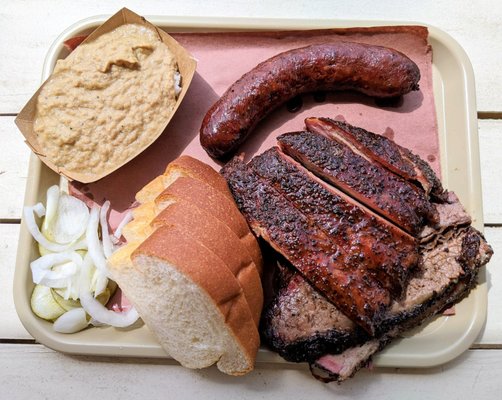
I want to click on basket, so click(189, 63).